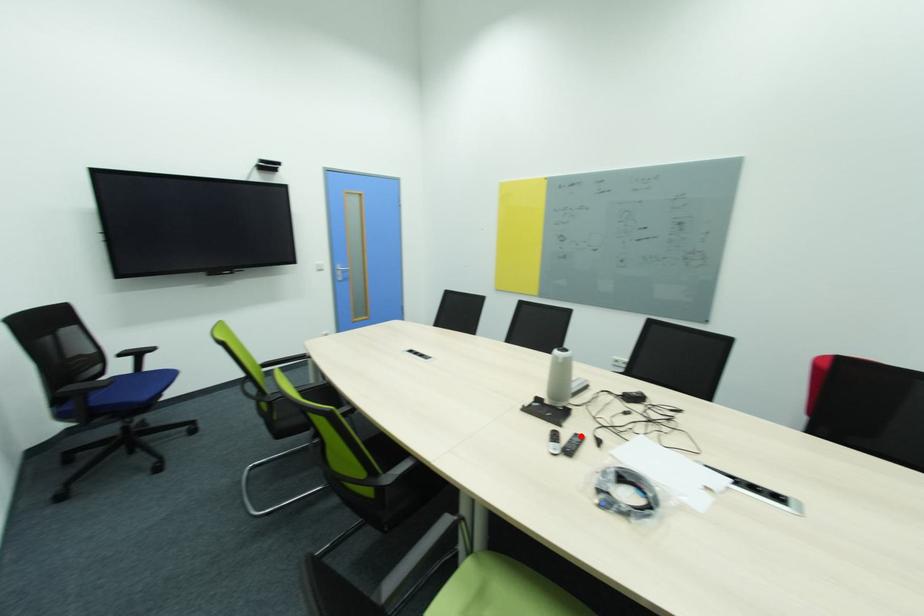
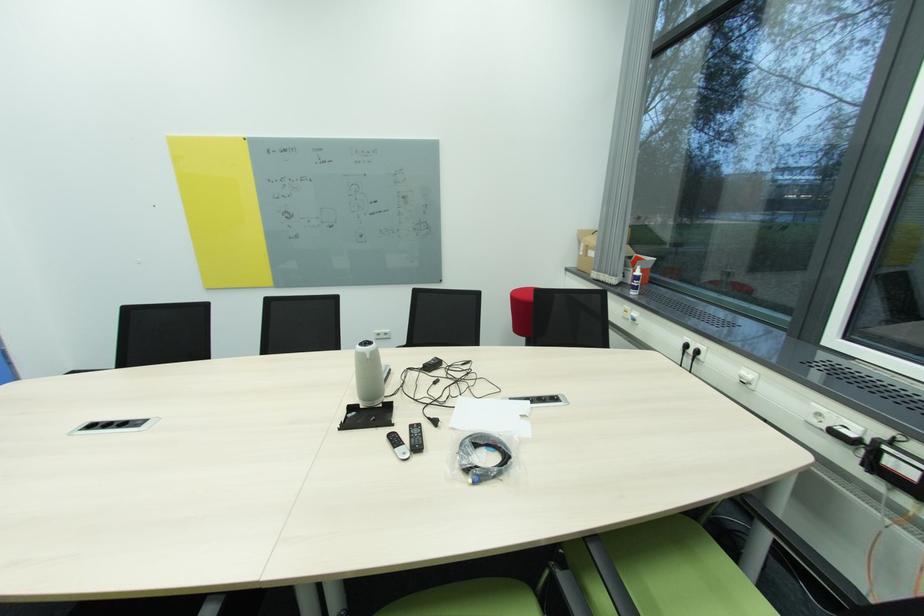
Find the pixel in the second image that matches the highlighted location in the first image.

(416, 427)